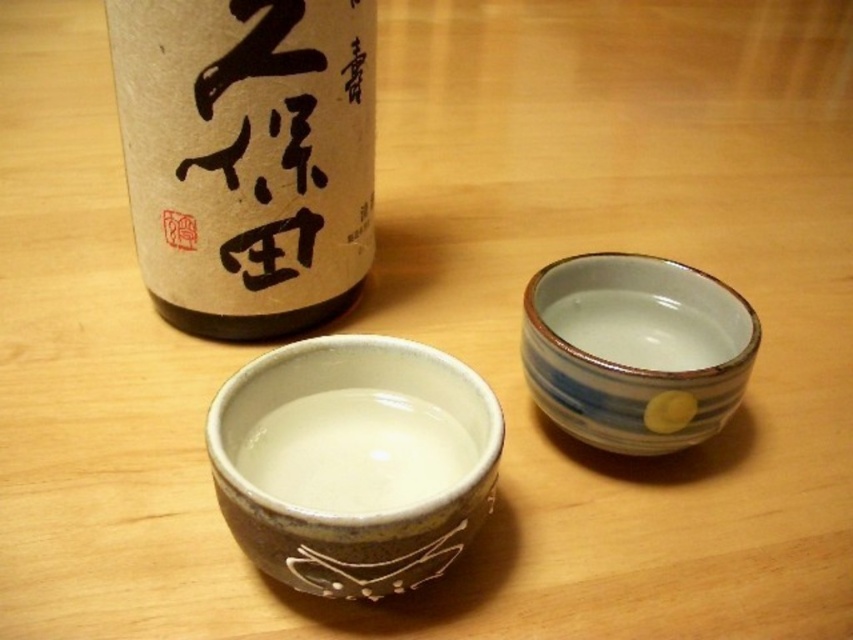
Question: Does matte ceramic bowl at center have a lesser width compared to white glossy bowl at center?

Choices:
 (A) no
 (B) yes

Answer: (A)

Question: Which of the following is the farthest from the observer?

Choices:
 (A) matte ceramic bowl at center
 (B) white glossy bowl at center

Answer: (B)

Question: Does matte ceramic bowl at center appear on the right side of blue striped ceramic cup at right?

Choices:
 (A) yes
 (B) no

Answer: (B)

Question: Which point appears farthest from the camera in this image?

Choices:
 (A) (320, 436)
 (B) (751, 337)
 (C) (367, 465)

Answer: (B)

Question: Which of these objects is positioned farthest from the blue striped ceramic cup at right?

Choices:
 (A) matte ceramic bowl at center
 (B) matte brown bottle at upper left
 (C) white glossy bowl at center

Answer: (B)

Question: Can you confirm if matte ceramic bowl at center is wider than white glossy bowl at center?

Choices:
 (A) yes
 (B) no

Answer: (A)